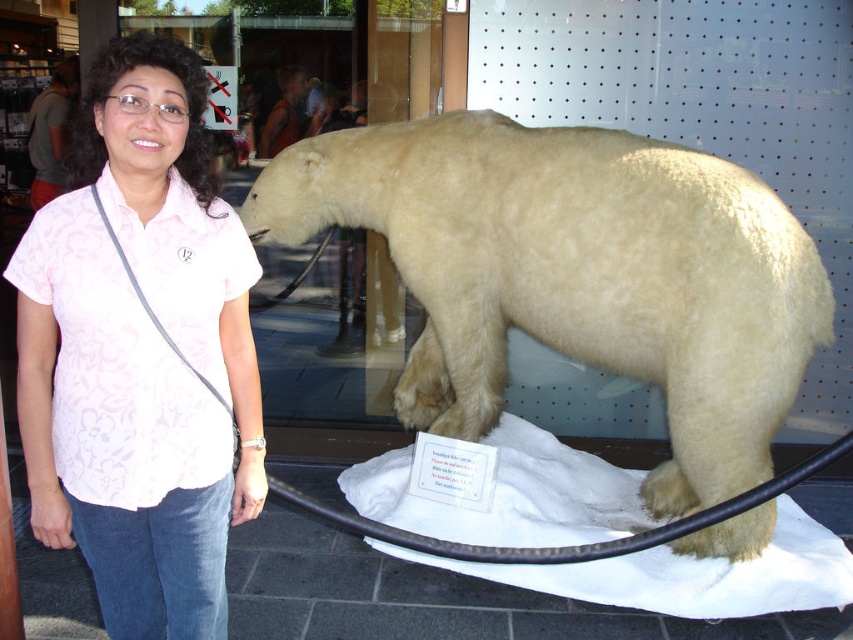
Is white fur polar bear at center taller than pink floral shirt at center?

Correct, white fur polar bear at center is much taller as pink floral shirt at center.

Is point (802, 228) positioned after point (109, 490)?

Yes, point (802, 228) is farther from viewer.

Which is in front, point (561, 561) or point (44, 385)?

Positioned in front is point (44, 385).

Find the location of a particular element. The height and width of the screenshot is (640, 853). white fur polar bear at center is located at coordinates (579, 294).